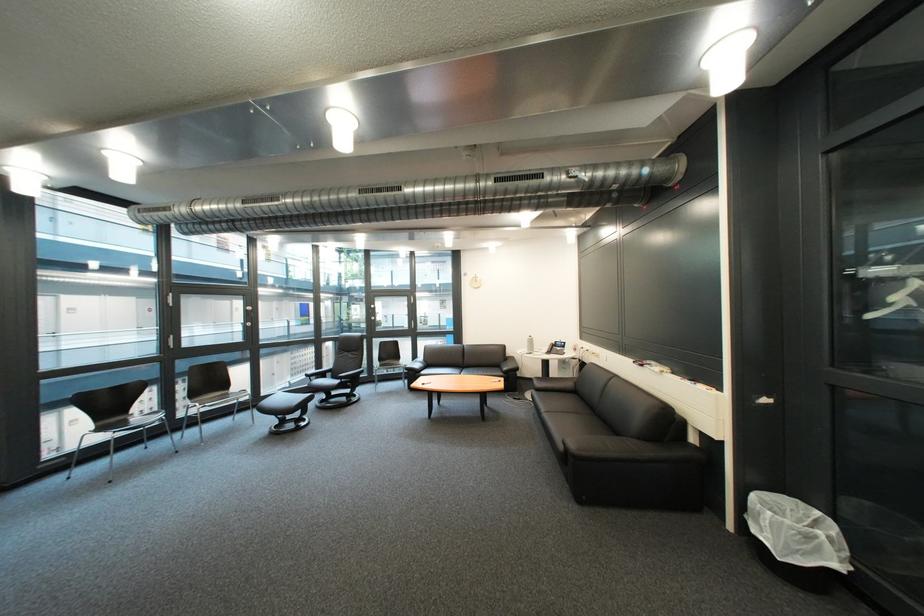
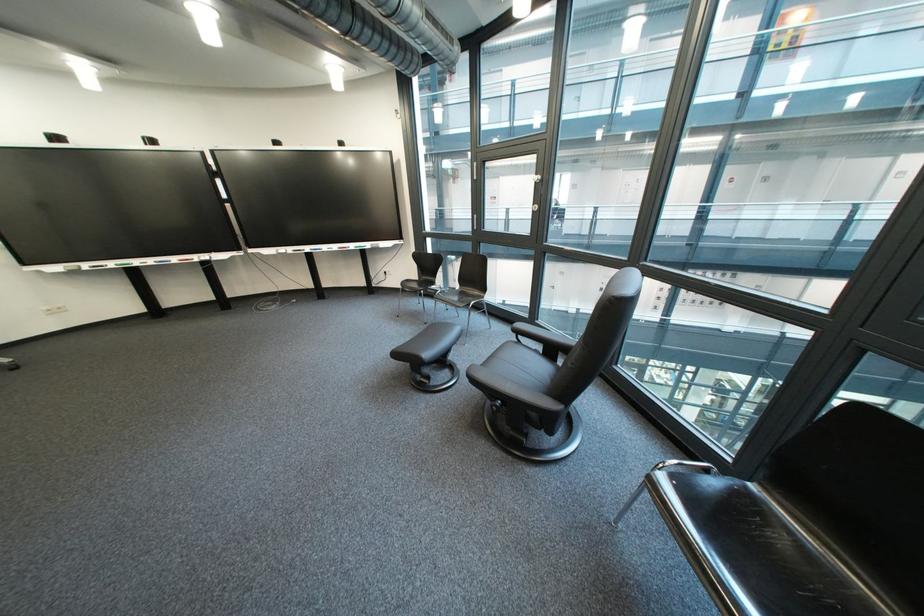
Find the pixel in the second image that matches [190,454] in the first image.

(439, 325)